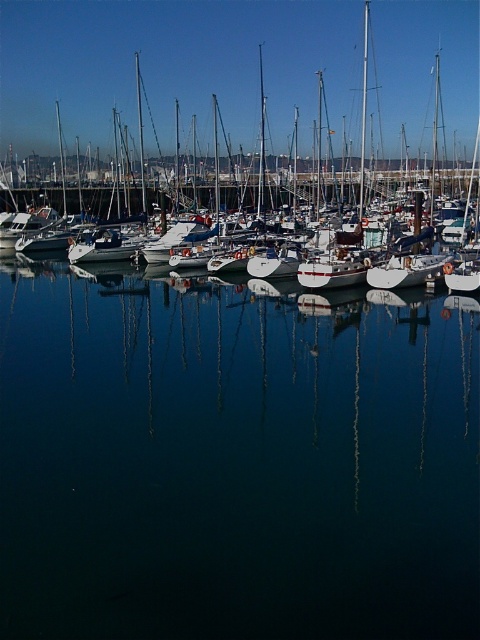
Question: Does dark blue water at center appear under white glossy sailboat at center?

Choices:
 (A) no
 (B) yes

Answer: (B)

Question: Among these objects, which one is farthest from the camera?

Choices:
 (A) dark blue water at center
 (B) white glossy sailboat at center

Answer: (B)

Question: Considering the relative positions of dark blue water at center and white glossy sailboat at center in the image provided, where is dark blue water at center located with respect to white glossy sailboat at center?

Choices:
 (A) below
 (B) above

Answer: (A)

Question: Is dark blue water at center positioned before white glossy sailboat at center?

Choices:
 (A) yes
 (B) no

Answer: (A)

Question: Which point is farther from the camera taking this photo?

Choices:
 (A) 404,381
 (B) 176,20

Answer: (B)